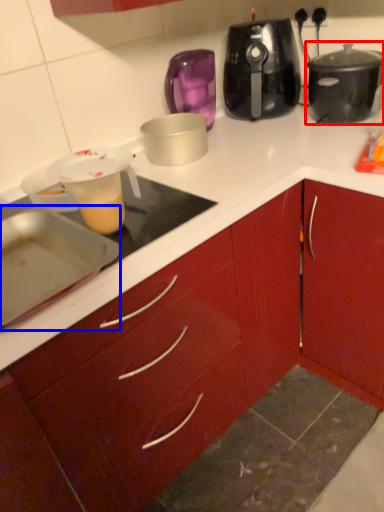
Question: Which object is closer to the camera taking this photo, slow cooker (highlighted by a red box) or kitchen appliance (highlighted by a blue box)?

Choices:
 (A) slow cooker
 (B) kitchen appliance

Answer: (B)